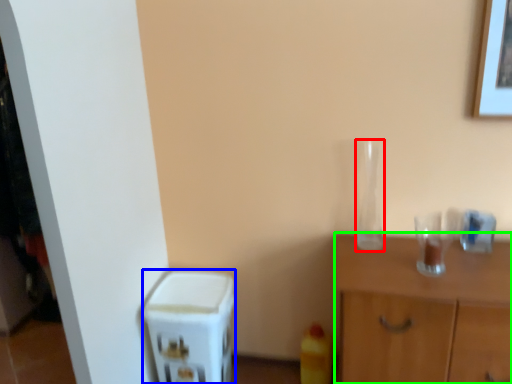
Question: Considering the real-world distances, which object is farthest from glass vase (highlighted by a red box)? appliance (highlighted by a blue box) or nightstand (highlighted by a green box)?

Choices:
 (A) appliance
 (B) nightstand

Answer: (A)